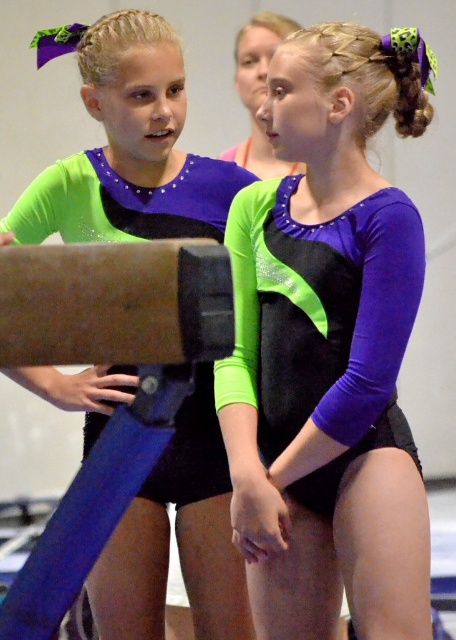
Can you confirm if purple matte leotard at center is smaller than matte black leotard at center?

Incorrect, purple matte leotard at center is not smaller in size than matte black leotard at center.

Is point (424, 605) positioned in front of point (156, 568)?

That is True.

Locate an element on the screen. The height and width of the screenshot is (640, 456). purple matte leotard at center is located at coordinates (327, 353).

Is the position of matte black leotard at center less distant than that of brown cardboard beam at center?

No, matte black leotard at center is behind brown cardboard beam at center.

Is point (98, 577) positioned behind point (29, 257)?

Yes, it is.

Which is behind, point (190, 481) or point (51, 321)?

The point (190, 481) is more distant.

Locate an element on the screen. matte black leotard at center is located at coordinates tap(129, 148).

Locate an element on the screen. Image resolution: width=456 pixels, height=640 pixels. purple matte leotard at center is located at coordinates (327, 353).

Between point (397, 554) and point (153, 305), which one is positioned in front?

Positioned in front is point (153, 305).

Does point (250, 296) come in front of point (113, 298)?

No, it is not.

The height and width of the screenshot is (640, 456). Find the location of `purple matte leotard at center`. purple matte leotard at center is located at coordinates (327, 353).